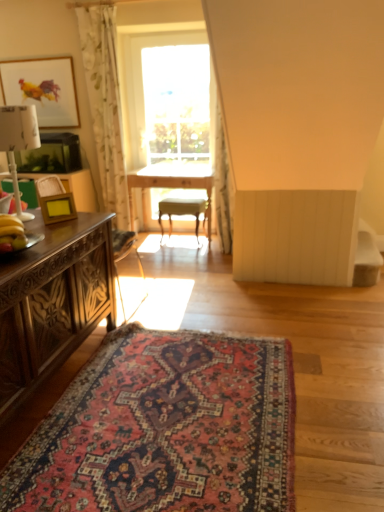
This screenshot has width=384, height=512. What do you see at coordinates (182, 211) in the screenshot? I see `light yellow wood chair at center` at bounding box center [182, 211].

Describe the element at coordinates (57, 208) in the screenshot. Image resolution: width=384 pixels, height=512 pixels. I see `wooden photo frame at left, the second picture frame viewed from the top` at that location.

In order to face wooden photo frame at left, the second picture frame viewed from the back, should I rotate leftwards or rightwards?

It's best to rotate left around 17.610 degrees.

Where is `matte wooden picture frame at upper left, the first picture frame when ordered from back to front`? The height and width of the screenshot is (512, 384). matte wooden picture frame at upper left, the first picture frame when ordered from back to front is located at coordinates (43, 89).

What do you see at coordinates (166, 98) in the screenshot? This screenshot has height=512, width=384. I see `clear glass window at center` at bounding box center [166, 98].

Looking at this image, in order to face white fabric lampshade at left, should I rotate leftwards or rightwards?

To face it directly, rotate left by 22.274 degrees.

What do you see at coordinates (18, 142) in the screenshot? I see `white fabric lampshade at left` at bounding box center [18, 142].

Identify the location of yellow matte banana at left. The image size is (384, 512). (11, 234).

Can you confirm if white fabric lampshade at left is thinner than matte wooden picture frame at upper left, which ranks as the 1th picture frame in left-to-right order?

No, white fabric lampshade at left is not thinner than matte wooden picture frame at upper left, which ranks as the 1th picture frame in left-to-right order.

From the image's perspective, would you say white fabric lampshade at left is positioned over matte wooden picture frame at upper left, which ranks as the 1th picture frame in left-to-right order?

No.

Based on their positions, is white fabric lampshade at left located to the left or right of matte wooden picture frame at upper left, which ranks as the 1th picture frame in left-to-right order?

From the image, it's evident that white fabric lampshade at left is to the right of matte wooden picture frame at upper left, which ranks as the 1th picture frame in left-to-right order.

Is white fabric lampshade at left oriented towards matte wooden picture frame at upper left, which ranks as the second picture frame in right-to-left order?

No, white fabric lampshade at left is not oriented towards matte wooden picture frame at upper left, which ranks as the second picture frame in right-to-left order.

Is carpeted mat at lower center touching matte wooden picture frame at upper left, the first picture frame when ordered from back to front?

No.

Is point (163, 384) behind point (2, 78)?

No, it is not.

Measure the distance between carpeted mat at lower center and matte wooden picture frame at upper left, the second picture frame in the front-to-back sequence.

They are 3.10 meters apart.

Does carpeted mat at lower center appear on the left side of matte wooden picture frame at upper left, the first picture frame when ordered from back to front?

No, carpeted mat at lower center is not to the left of matte wooden picture frame at upper left, the first picture frame when ordered from back to front.

How many degrees apart are the facing directions of matte wooden picture frame at upper left, the 1th picture frame in the top-to-bottom sequence, and carved wood desk at left?

The angle between the facing direction of matte wooden picture frame at upper left, the 1th picture frame in the top-to-bottom sequence, and the facing direction of carved wood desk at left is 86.9 degrees.

Does matte wooden picture frame at upper left, the 1th picture frame in the top-to-bottom sequence, have a larger size compared to carved wood desk at left?

Incorrect, matte wooden picture frame at upper left, the 1th picture frame in the top-to-bottom sequence, is not larger than carved wood desk at left.

Is matte wooden picture frame at upper left, the second picture frame in the front-to-back sequence, wider or thinner than carved wood desk at left?

Clearly, matte wooden picture frame at upper left, the second picture frame in the front-to-back sequence, has less width compared to carved wood desk at left.

Considering the relative positions of white floral fabric curtain at upper center, positioned as the first curtain in right-to-left order, and carpeted mat at lower center in the image provided, is white floral fabric curtain at upper center, positioned as the first curtain in right-to-left order, behind carpeted mat at lower center?

That is True.

I want to click on curtain that is the 1st one when counting upward from the carpeted mat at lower center (from the image's perspective), so click(223, 184).

Considering the relative sizes of white floral fabric curtain at upper center, marked as the second curtain in a left-to-right arrangement, and carpeted mat at lower center in the image provided, is white floral fabric curtain at upper center, marked as the second curtain in a left-to-right arrangement, thinner than carpeted mat at lower center?

Correct, the width of white floral fabric curtain at upper center, marked as the second curtain in a left-to-right arrangement, is less than that of carpeted mat at lower center.

From the image's perspective, is white floral fabric curtain at upper center, marked as the second curtain in a left-to-right arrangement, under carpeted mat at lower center?

Actually, white floral fabric curtain at upper center, marked as the second curtain in a left-to-right arrangement, appears above carpeted mat at lower center in the image.

The image size is (384, 512). What are the coordinates of `curtain that appears below the translucent floral fabric at left, the 2th curtain when ordered from right to left (from a real-world perspective)` in the screenshot? It's located at 223,184.

Looking at this image, is translucent floral fabric at left, the 1th curtain viewed from the left, spatially inside white floral fabric curtain at upper center, positioned as the first curtain in right-to-left order, or outside of it?

translucent floral fabric at left, the 1th curtain viewed from the left, is not enclosed by white floral fabric curtain at upper center, positioned as the first curtain in right-to-left order.

Considering the positions of points (93, 84) and (216, 209), is point (93, 84) farther from camera compared to point (216, 209)?

No, it is in front of (216, 209).

Is translucent floral fabric at left, the 1th curtain viewed from the left, in front of or behind white floral fabric curtain at upper center, marked as the second curtain in a left-to-right arrangement, in the image?

translucent floral fabric at left, the 1th curtain viewed from the left, is positioned farther from the viewer than white floral fabric curtain at upper center, marked as the second curtain in a left-to-right arrangement.

Considering the relative sizes of matte wooden picture frame at upper left, the second picture frame in the front-to-back sequence, and carpeted mat at lower center in the image provided, is matte wooden picture frame at upper left, the second picture frame in the front-to-back sequence, taller than carpeted mat at lower center?

Yes, matte wooden picture frame at upper left, the second picture frame in the front-to-back sequence, is taller than carpeted mat at lower center.

Considering the points (53, 73) and (125, 439), which point is in front, point (53, 73) or point (125, 439)?

Point (125, 439)

Is matte wooden picture frame at upper left, the second picture frame in the front-to-back sequence, looking in the opposite direction of carpeted mat at lower center?

matte wooden picture frame at upper left, the second picture frame in the front-to-back sequence, is not turned away from carpeted mat at lower center.

Considering the relative sizes of yellow matte banana at left and wooden table at center in the image provided, is yellow matte banana at left smaller than wooden table at center?

Yes.

Which is in front, point (0, 237) or point (157, 167)?

Point (0, 237)

You are a GUI agent. You are given a task and a screenshot of the screen. Output one action in this format:
    pyautogui.click(x=<x>, y=<y>)
    Task: Click on the table below the yellow matte banana at left (from a real-world perspective)
    
    Given the screenshot: What is the action you would take?
    pyautogui.click(x=171, y=183)

This screenshot has width=384, height=512. I want to click on picture frame that is above the white fabric lampshade at left (from the image's perspective), so click(x=43, y=89).

You are a GUI agent. You are given a task and a screenshot of the screen. Output one action in this format:
    pyautogui.click(x=<x>, y=<y>)
    Task: Click on the mat located on the right of matte wooden picture frame at upper left, the 2th picture frame when ordered from bottom to top
    
    Given the screenshot: What is the action you would take?
    pyautogui.click(x=165, y=429)

From the picture: Considering their positions, is clear glass window at center positioned further to carved wood desk at left than light yellow wood chair at center?

clear glass window at center is positioned further to the anchor carved wood desk at left.

Consider the image. Considering their positions, is light yellow wood chair at center positioned closer to carved wood desk at left than matte wooden picture frame at upper left, the second picture frame in the front-to-back sequence?

light yellow wood chair at center is closer to carved wood desk at left.

From the image, which object appears to be nearer to translucent floral fabric at left, the 2th curtain when ordered from right to left, wooden photo frame at left, the 1th picture frame ordered from the bottom, or white fabric lampshade at left?

wooden photo frame at left, the 1th picture frame ordered from the bottom, is positioned closer to the anchor translucent floral fabric at left, the 2th curtain when ordered from right to left.

Looking at the image, which one is located closer to light yellow wood chair at center, white floral fabric curtain at upper center, positioned as the first curtain in right-to-left order, or translucent floral fabric at left, the 1th curtain viewed from the left?

white floral fabric curtain at upper center, positioned as the first curtain in right-to-left order, is positioned closer to the anchor light yellow wood chair at center.

Based on their spatial positions, is matte wooden picture frame at upper left, the 1th picture frame in the top-to-bottom sequence, or white floral fabric curtain at upper center, positioned as the first curtain in right-to-left order, further from yellow matte banana at left?

matte wooden picture frame at upper left, the 1th picture frame in the top-to-bottom sequence.

From the image, which object appears to be nearer to yellow matte banana at left, translucent floral fabric at left, the 1th curtain viewed from the left, or carpeted mat at lower center?

carpeted mat at lower center is positioned closer to the anchor yellow matte banana at left.

Looking at the image, which one is located closer to wooden table at center, wooden photo frame at left, the first picture frame in the right-to-left sequence, or yellow matte banana at left?

wooden photo frame at left, the first picture frame in the right-to-left sequence, lies closer to wooden table at center than the other object.

Based on the photo, considering their positions, is carpeted mat at lower center positioned further to matte wooden picture frame at upper left, which ranks as the 1th picture frame in left-to-right order, than wooden photo frame at left, the second picture frame viewed from the back?

carpeted mat at lower center.

The width and height of the screenshot is (384, 512). Find the location of `picture frame between white fabric lampshade at left and white floral fabric curtain at upper center, marked as the second curtain in a left-to-right arrangement, in the front-back direction`. picture frame between white fabric lampshade at left and white floral fabric curtain at upper center, marked as the second curtain in a left-to-right arrangement, in the front-back direction is located at coordinates (57, 208).

Find the location of `picture frame between white fabric lampshade at left and yellow matte banana at left in the vertical direction`. picture frame between white fabric lampshade at left and yellow matte banana at left in the vertical direction is located at coordinates (x=57, y=208).

I want to click on picture frame between white fabric lampshade at left and carpeted mat at lower center in the vertical direction, so click(57, 208).

At what (x,y) coordinates should I click in order to perform the action: click on table between wooden photo frame at left, the first picture frame in the right-to-left sequence, and matte wooden picture frame at upper left, the second picture frame in the front-to-back sequence, in the front-back direction. Please return your answer as a coordinate pair (x, y). Looking at the image, I should click on (x=171, y=183).